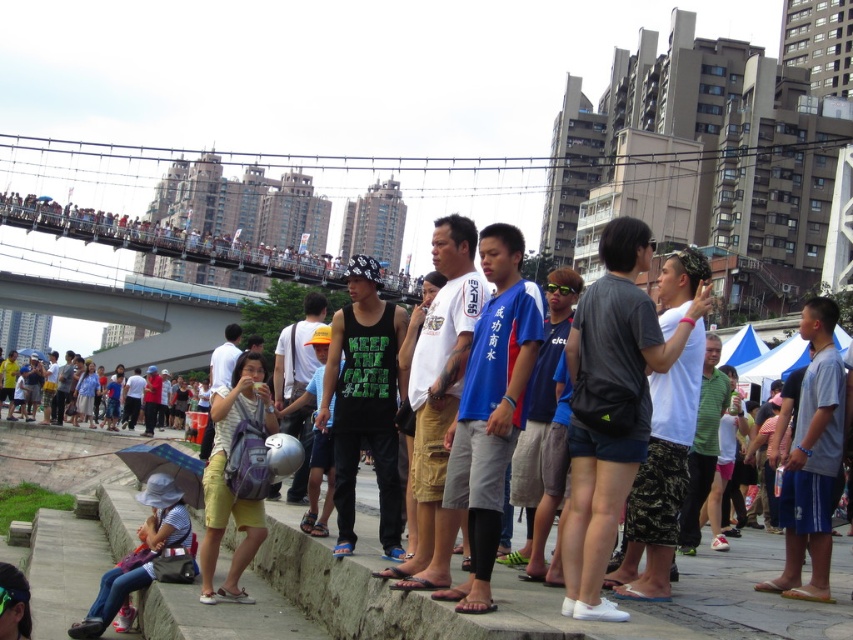
Between blue fabric shirt at center and matte black backpack at center, which one appears on the right side from the viewer's perspective?

blue fabric shirt at center is more to the right.

Locate an element on the screen. blue fabric shirt at center is located at coordinates (490, 408).

Can you confirm if blue fabric shirt at center is wider than white cotton t-shirt at center?

Yes.

Does blue fabric shirt at center appear over white cotton t-shirt at center?

Correct, blue fabric shirt at center is located above white cotton t-shirt at center.

From the picture: Measure the distance between point (486,460) and camera.

A distance of 25.90 meters exists between point (486,460) and camera.

You are a GUI agent. You are given a task and a screenshot of the screen. Output one action in this format:
    pyautogui.click(x=<x>, y=<y>)
    Task: Click on the blue fabric shirt at center
    This screenshot has height=640, width=853.
    Given the screenshot: What is the action you would take?
    pyautogui.click(x=490, y=408)

Can you confirm if white cotton t-shirt at center is positioned above matte black backpack at center?

Indeed, white cotton t-shirt at center is positioned over matte black backpack at center.

Locate an element on the screen. white cotton t-shirt at center is located at coordinates tap(438, 390).

Is point (457, 525) positioned before point (184, 362)?

Yes, point (457, 525) is in front of point (184, 362).

I want to click on white cotton t-shirt at center, so click(x=438, y=390).